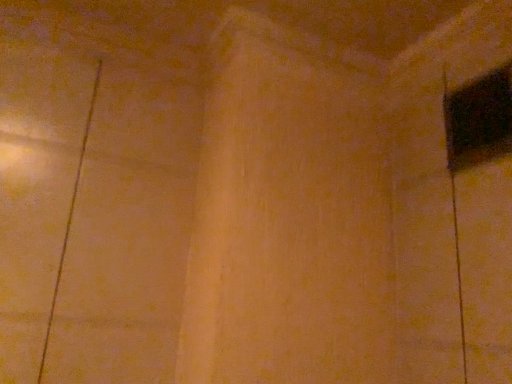
The height and width of the screenshot is (384, 512). What do you see at coordinates (479, 119) in the screenshot?
I see `transparent glass window at upper right` at bounding box center [479, 119].

Measure the distance between point (510, 147) and camera.

Point (510, 147) and camera are 72.00 centimeters apart from each other.

The width and height of the screenshot is (512, 384). What are the coordinates of `transparent glass window at upper right` in the screenshot? It's located at (479, 119).

In order to click on transparent glass window at upper right in this screenshot , I will do `click(479, 119)`.